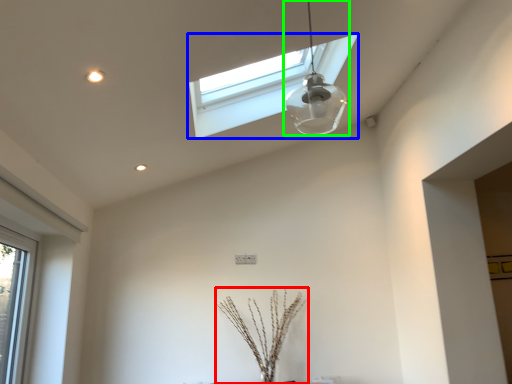
Question: Which is farther away from plant (highlighted by a red box)? window (highlighted by a blue box) or lamp (highlighted by a green box)?

Choices:
 (A) window
 (B) lamp

Answer: (A)